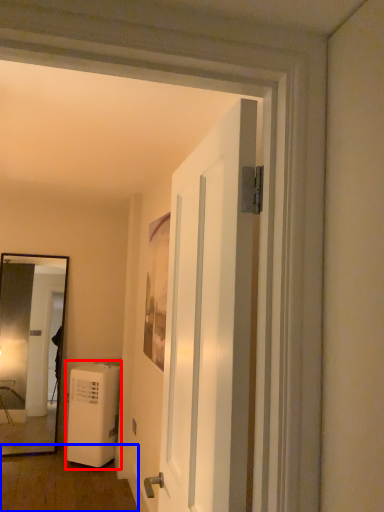
Question: Which of the following is the farthest to the observer, air conditioner (highlighted by a red box) or corridor (highlighted by a blue box)?

Choices:
 (A) air conditioner
 (B) corridor

Answer: (A)